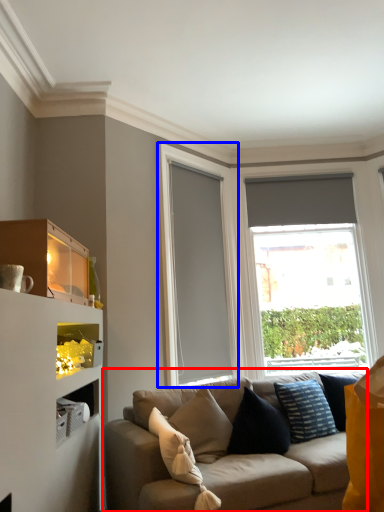
Question: Which of the following is the farthest to the observer, studio couch (highlighted by a red box) or glass door (highlighted by a blue box)?

Choices:
 (A) studio couch
 (B) glass door

Answer: (B)